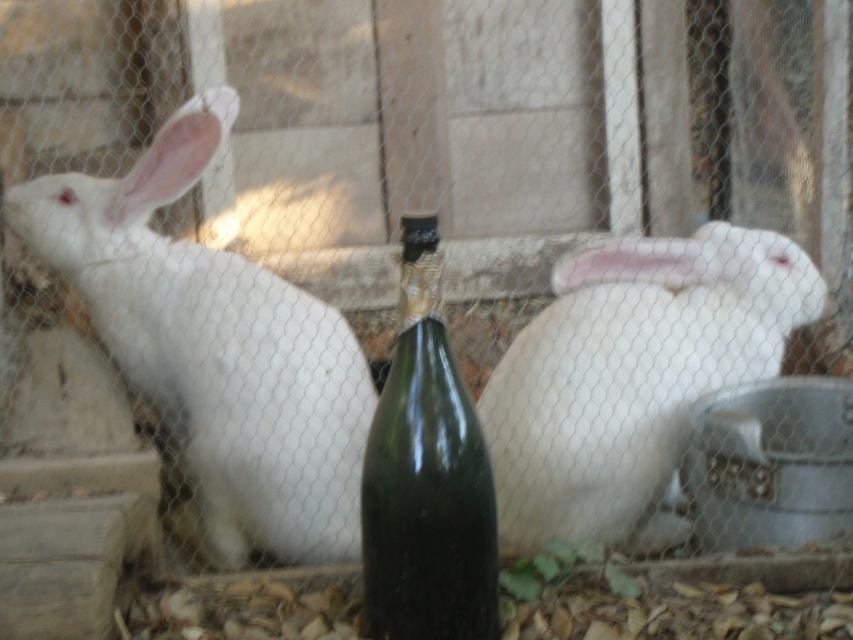
You are a small toy mouse that is 3 inches tall. You want to hide behind the white matte fur at left and the green glass bottle at center. Which object would allow you to hide completely without being seen from above?

The white matte fur at left has a greater height compared to the green glass bottle at center, so the white matte fur at left would allow you to hide completely without being seen from above.

In the scene shown: You are a farmer checking the enclosure for the rabbits. You notice two rabbits with white matte fur at left and white matte fur at center. Which rabbit has a larger body size?

The white matte fur at left has a larger body size since its width surpasses that of the white matte fur at center.

You are a small toy mouse that is 5 cm tall. You want to hide under the white matte fur at center so that you are completely hidden from view. Can you do this while staying under the green glass bottle at center?

The white matte fur at center is not as tall as the green glass bottle at center, so the toy mouse can hide under the white matte fur at center and still be hidden from view under the green glass bottle at center.